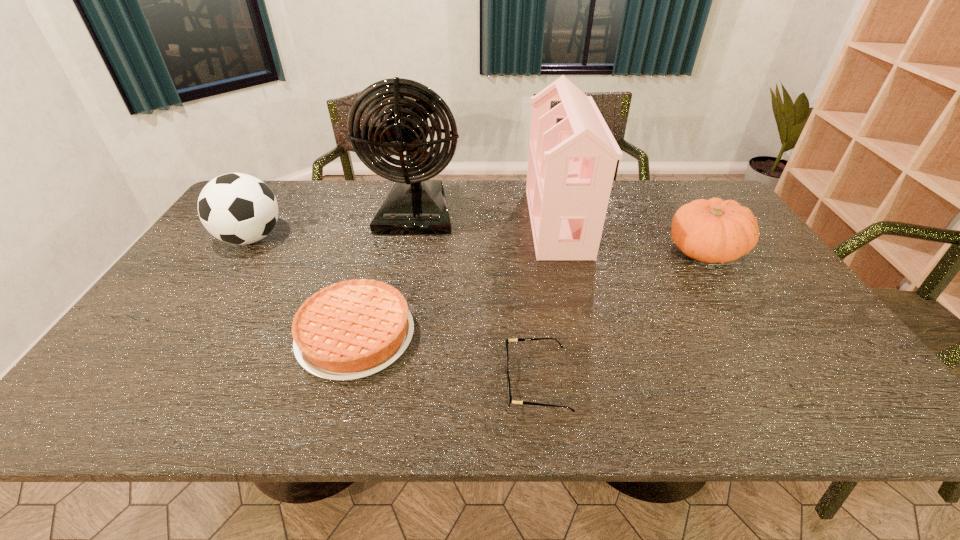
Where is `free space between the soccer ball and the fan`? The image size is (960, 540). free space between the soccer ball and the fan is located at coordinates (334, 226).

Where is `vacant space in between the third tallest object and the second shortest object`? Image resolution: width=960 pixels, height=540 pixels. vacant space in between the third tallest object and the second shortest object is located at coordinates (303, 287).

Image resolution: width=960 pixels, height=540 pixels. Find the location of `empty space between the pie and the dollhouse`. empty space between the pie and the dollhouse is located at coordinates (457, 279).

Where is `vacant area that lies between the dollhouse and the shortest object`? This screenshot has width=960, height=540. vacant area that lies between the dollhouse and the shortest object is located at coordinates (547, 302).

Locate an element on the screen. This screenshot has width=960, height=540. free spot between the dollhouse and the spectacles is located at coordinates (547, 302).

Where is `the third closest object to the pumpkin`? the third closest object to the pumpkin is located at coordinates [x=416, y=205].

Locate an element on the screen. The width and height of the screenshot is (960, 540). the closest object to the second shortest object is located at coordinates [518, 339].

Where is `vacant space that satisfies the following two spatial constraints: 1. on the front-facing side of the rightmost object; 2. on the left side of the dollhouse`? This screenshot has width=960, height=540. vacant space that satisfies the following two spatial constraints: 1. on the front-facing side of the rightmost object; 2. on the left side of the dollhouse is located at coordinates (564, 250).

The width and height of the screenshot is (960, 540). I want to click on vacant area that satisfies the following two spatial constraints: 1. on the front side of the fifth tallest object; 2. on the right side of the soccer ball, so click(186, 335).

Where is `vacant space that satisfies the following two spatial constraints: 1. on the front side of the pie; 2. on the right side of the third tallest object`? The image size is (960, 540). vacant space that satisfies the following two spatial constraints: 1. on the front side of the pie; 2. on the right side of the third tallest object is located at coordinates (186, 335).